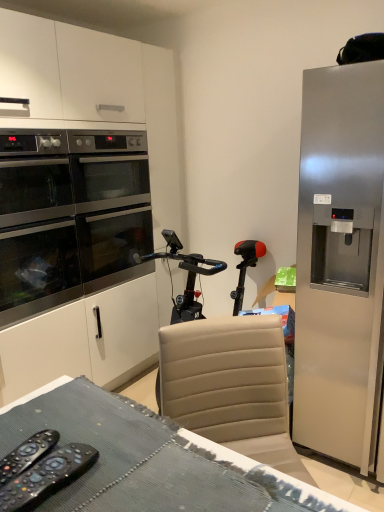
The image size is (384, 512). I want to click on stainless steel oven at left, so click(x=69, y=215).

What is the approximate height of black plastic remote control at lower left, the second remote control when ordered from right to left?

It is 2.58 centimeters.

Where is `stainless steel oven at left`? This screenshot has height=512, width=384. stainless steel oven at left is located at coordinates (69, 215).

Between stainless steel oven at left and black plastic remote controls at lower left, which ranks as the 2th remote control in left-to-right order, which one has smaller width?

With smaller width is black plastic remote controls at lower left, which ranks as the 2th remote control in left-to-right order.

Is black plastic remote controls at lower left, the 1th remote control positioned from the right, inside stainless steel oven at left?

No, black plastic remote controls at lower left, the 1th remote control positioned from the right, is not surrounded by stainless steel oven at left.

This screenshot has height=512, width=384. In order to click on home appliance behind the black plastic remote controls at lower left, which ranks as the 2th remote control in left-to-right order in this screenshot , I will do click(x=69, y=215).

Would you say stainless steel oven at left is a long distance from black plastic remote controls at lower left, which ranks as the 2th remote control in left-to-right order?

Indeed, stainless steel oven at left is not near black plastic remote controls at lower left, which ranks as the 2th remote control in left-to-right order.

At what (x,y) coordinates should I click in order to perform the action: click on desk above the satin silver refrigerator at right (from a real-world perspective). Please return your answer as a coordinate pair (x, y). Looking at the image, I should click on (158, 457).

Consider the image. Does textured gray fabric desk at center have a larger size compared to satin silver refrigerator at right?

No.

Considering the positions of objects textured gray fabric desk at center and satin silver refrigerator at right in the image provided, who is behind, textured gray fabric desk at center or satin silver refrigerator at right?

satin silver refrigerator at right is behind.

Does textured gray fabric desk at center appear on the left side of satin silver refrigerator at right?

Yes, textured gray fabric desk at center is to the left of satin silver refrigerator at right.

Is satin silver refrigerator at right facing away from black plastic remote controls at lower left, the 1th remote control positioned from the right?

No, satin silver refrigerator at right's orientation is not away from black plastic remote controls at lower left, the 1th remote control positioned from the right.

Is point (308, 362) closer or farther from the camera than point (38, 504)?

Point (308, 362) is positioned farther from the camera compared to point (38, 504).

Can you confirm if satin silver refrigerator at right is positioned to the right of black plastic remote controls at lower left, which ranks as the 2th remote control in left-to-right order?

Yes.

Are black plastic remote controls at lower left, which ranks as the 2th remote control in left-to-right order, and satin silver refrigerator at right located far from each other?

Yes, black plastic remote controls at lower left, which ranks as the 2th remote control in left-to-right order, and satin silver refrigerator at right are quite far apart.

Considering the sizes of objects black plastic remote controls at lower left, the 1th remote control positioned from the right, and satin silver refrigerator at right in the image provided, who is taller, black plastic remote controls at lower left, the 1th remote control positioned from the right, or satin silver refrigerator at right?

satin silver refrigerator at right.

From a real-world perspective, which object rests below the other?

satin silver refrigerator at right, from a real-world perspective.

In terms of width, does black plastic remote controls at lower left, the 1th remote control positioned from the right, look wider or thinner when compared to satin silver refrigerator at right?

In the image, black plastic remote controls at lower left, the 1th remote control positioned from the right, appears to be more narrow than satin silver refrigerator at right.

Between point (337, 402) and point (46, 196), which one is positioned behind?

The point (46, 196) is more distant.

Is stainless steel oven at left completely or partially inside satin silver refrigerator at right?

No.

Does satin silver refrigerator at right have a lesser height compared to stainless steel oven at left?

Incorrect, the height of satin silver refrigerator at right does not fall short of that of stainless steel oven at left.

Is black plastic remote controls at lower left, which ranks as the 2th remote control in left-to-right order, looking in the opposite direction of black plastic remote control at lower left, the second remote control when ordered from right to left?

Absolutely, black plastic remote controls at lower left, which ranks as the 2th remote control in left-to-right order, is directed away from black plastic remote control at lower left, the second remote control when ordered from right to left.

Is black plastic remote controls at lower left, which ranks as the 2th remote control in left-to-right order, placed right next to black plastic remote control at lower left, the second remote control when ordered from right to left?

Yes, black plastic remote controls at lower left, which ranks as the 2th remote control in left-to-right order, is with black plastic remote control at lower left, the second remote control when ordered from right to left.

Which point is more forward, [1,504] or [42,453]?

The point [1,504] is more forward.

Looking at their sizes, would you say black plastic remote controls at lower left, the 1th remote control positioned from the right, is wider or thinner than black plastic remote control at lower left, the second remote control when ordered from right to left?

black plastic remote controls at lower left, the 1th remote control positioned from the right, is wider than black plastic remote control at lower left, the second remote control when ordered from right to left.

Can you confirm if black plastic remote control at lower left, which ranks as the first remote control in left-to-right order, is positioned to the left of stainless steel oven at left?

Incorrect, black plastic remote control at lower left, which ranks as the first remote control in left-to-right order, is not on the left side of stainless steel oven at left.

Looking at this image, is black plastic remote control at lower left, which ranks as the first remote control in left-to-right order, far from stainless steel oven at left?

Indeed, black plastic remote control at lower left, which ranks as the first remote control in left-to-right order, is not near stainless steel oven at left.

Is point (36, 453) closer to viewer compared to point (89, 267)?

Yes, it is.

Between black plastic remote control at lower left, the second remote control when ordered from right to left, and stainless steel oven at left, which one has larger width?

stainless steel oven at left.

Locate an element on the screen. home appliance that is above the black plastic remote controls at lower left, which ranks as the 2th remote control in left-to-right order (from the image's perspective) is located at coordinates (69, 215).

You are a GUI agent. You are given a task and a screenshot of the screen. Output one action in this format:
    pyautogui.click(x=<x>, y=<y>)
    Task: Click on the refrigerator below the textured gray fabric desk at center (from a real-world perspective)
    Image resolution: width=384 pixels, height=512 pixels.
    Given the screenshot: What is the action you would take?
    pyautogui.click(x=340, y=263)

Which object lies nearer to the anchor point satin silver refrigerator at right, stainless steel oven at left or black plastic remote controls at lower left, which ranks as the 2th remote control in left-to-right order?

Based on the image, stainless steel oven at left appears to be nearer to satin silver refrigerator at right.

Which object lies nearer to the anchor point satin silver refrigerator at right, stainless steel oven at left or black plastic remote control at lower left, the second remote control when ordered from right to left?

stainless steel oven at left.

Which object lies further to the anchor point satin silver refrigerator at right, black plastic remote controls at lower left, the 1th remote control positioned from the right, or stainless steel oven at left?

The object further to satin silver refrigerator at right is black plastic remote controls at lower left, the 1th remote control positioned from the right.

Which object lies nearer to the anchor point black plastic remote controls at lower left, the 1th remote control positioned from the right, textured gray fabric desk at center or satin silver refrigerator at right?

The object closer to black plastic remote controls at lower left, the 1th remote control positioned from the right, is textured gray fabric desk at center.

Which object lies nearer to the anchor point black plastic remote controls at lower left, the 1th remote control positioned from the right, satin silver refrigerator at right or stainless steel oven at left?

The object closer to black plastic remote controls at lower left, the 1th remote control positioned from the right, is satin silver refrigerator at right.

From the image, which object appears to be farther from black plastic remote controls at lower left, the 1th remote control positioned from the right, satin silver refrigerator at right or black plastic remote control at lower left, which ranks as the first remote control in left-to-right order?

satin silver refrigerator at right is positioned further to the anchor black plastic remote controls at lower left, the 1th remote control positioned from the right.

When comparing their distances from satin silver refrigerator at right, does black plastic remote control at lower left, the second remote control when ordered from right to left, or textured gray fabric desk at center seem further?

black plastic remote control at lower left, the second remote control when ordered from right to left, lies further to satin silver refrigerator at right than the other object.

Consider the image. Looking at the image, which one is located further to black plastic remote controls at lower left, which ranks as the 2th remote control in left-to-right order, textured gray fabric desk at center or black plastic remote control at lower left, which ranks as the first remote control in left-to-right order?

textured gray fabric desk at center is positioned further to the anchor black plastic remote controls at lower left, which ranks as the 2th remote control in left-to-right order.

This screenshot has height=512, width=384. I want to click on remote control between black plastic remote control at lower left, which ranks as the first remote control in left-to-right order, and satin silver refrigerator at right, in the horizontal direction, so click(x=47, y=477).

Locate an element on the screen. desk between black plastic remote controls at lower left, which ranks as the 2th remote control in left-to-right order, and satin silver refrigerator at right, in the horizontal direction is located at coordinates (158, 457).

The width and height of the screenshot is (384, 512). Find the location of `remote control between textured gray fabric desk at center and black plastic remote control at lower left, which ranks as the first remote control in left-to-right order, from front to back`. remote control between textured gray fabric desk at center and black plastic remote control at lower left, which ranks as the first remote control in left-to-right order, from front to back is located at coordinates (47, 477).

You are a GUI agent. You are given a task and a screenshot of the screen. Output one action in this format:
    pyautogui.click(x=<x>, y=<y>)
    Task: Click on the desk between black plastic remote control at lower left, which ranks as the first remote control in left-to-right order, and satin silver refrigerator at right from left to right
    
    Given the screenshot: What is the action you would take?
    [x=158, y=457]